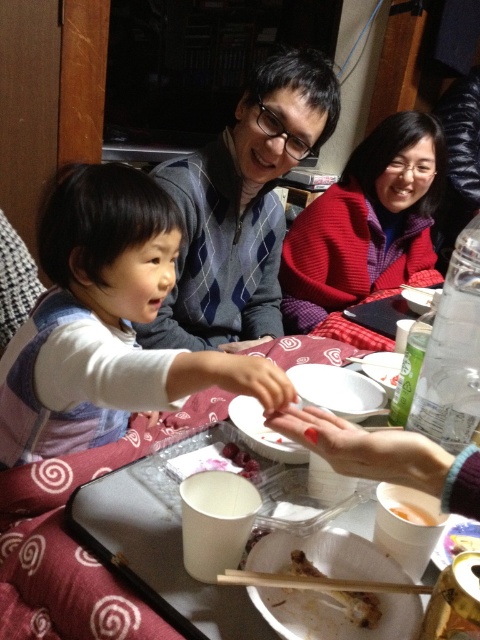
Question: Is matte gray sweater at center above white paper tray at lower center?

Choices:
 (A) no
 (B) yes

Answer: (B)

Question: Can you confirm if red fleece sweater at upper right is bigger than white paper tray at lower center?

Choices:
 (A) yes
 (B) no

Answer: (A)

Question: Which point is farther to the camera?

Choices:
 (A) matte blue vest at lower left
 (B) brown wooden chopsticks at lower center

Answer: (A)

Question: Does matte blue vest at lower left appear under white paper tray at lower center?

Choices:
 (A) yes
 (B) no

Answer: (B)

Question: Estimate the real-world distances between objects in this image. Which object is farther from the matte blue vest at lower left?

Choices:
 (A) white paper tray at lower center
 (B) matte gray sweater at center
 (C) brown wooden chopsticks at lower center

Answer: (B)

Question: Which object is closer to the camera taking this photo?

Choices:
 (A) matte blue vest at lower left
 (B) white paper tray at lower center

Answer: (B)